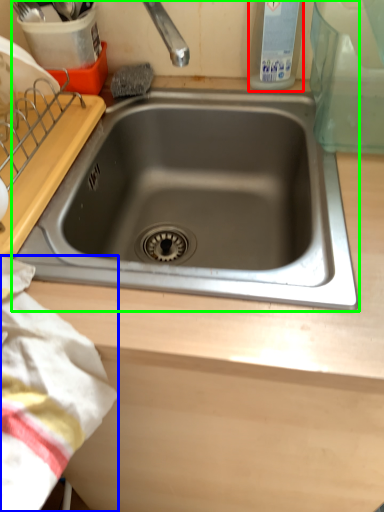
Question: Which is nearer to the bottle (highlighted by a red box)? blanket (highlighted by a blue box) or sink (highlighted by a green box).

Choices:
 (A) blanket
 (B) sink

Answer: (B)